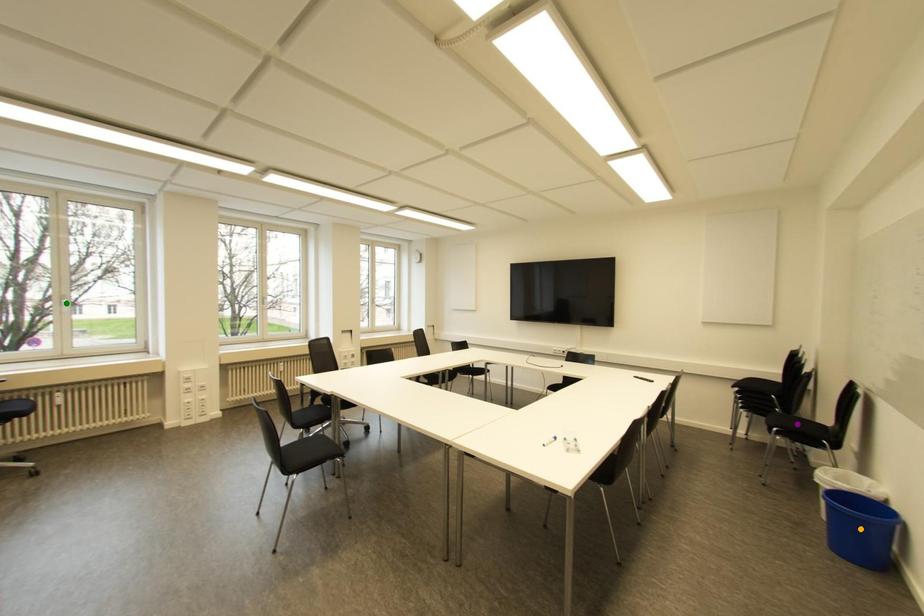
Order these from nearest to farthest:
- orange point
- purple point
- green point

1. orange point
2. purple point
3. green point